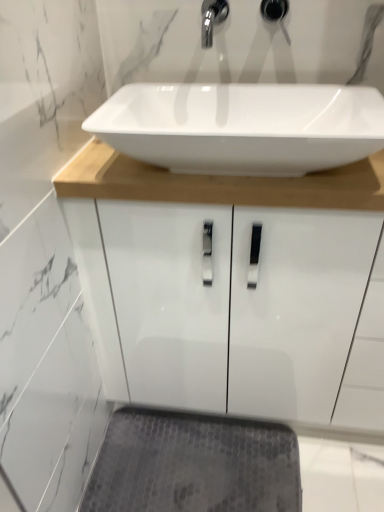
Image resolution: width=384 pixels, height=512 pixels. What do you see at coordinates (238, 87) in the screenshot? I see `white glossy sink at center` at bounding box center [238, 87].

Identify the location of matte black faucet at upper center. The height and width of the screenshot is (512, 384). (276, 13).

Is matte black faucet at upper center positioned before white glossy sink at center?

No, matte black faucet at upper center is further to the viewer.

Considering the sizes of objects matte black faucet at upper center and white glossy sink at center in the image provided, who is thinner, matte black faucet at upper center or white glossy sink at center?

Thinner between the two is matte black faucet at upper center.

Measure the distance from matte black faucet at upper center to white glossy sink at center.

The distance of matte black faucet at upper center from white glossy sink at center is 9.94 inches.

Who is shorter, matte black faucet at upper center or white glossy sink at center?

With less height is white glossy sink at center.

Considering the relative sizes of white glossy sink at center and matte black faucet at upper center in the image provided, is white glossy sink at center shorter than matte black faucet at upper center?

Yes.

Is white glossy sink at center bigger or smaller than matte black faucet at upper center?

Clearly, white glossy sink at center is larger in size than matte black faucet at upper center.

Locate an element on the screen. The width and height of the screenshot is (384, 512). sink that appears below the matte black faucet at upper center (from a real-world perspective) is located at coordinates (238, 87).

Is gray textured bath mat at lower center taller than matte black faucet at upper center?

No.

Between gray textured bath mat at lower center and matte black faucet at upper center, which one appears on the right side from the viewer's perspective?

matte black faucet at upper center.

Looking at this image, how far apart are gray textured bath mat at lower center and matte black faucet at upper center?

They are 1.18 meters apart.

Does gray textured bath mat at lower center have a larger size compared to matte black faucet at upper center?

Yes.

Which object is positioned more to the right, gray textured bath mat at lower center or white glossy sink at center?

white glossy sink at center.

Do you think gray textured bath mat at lower center is within white glossy sink at center, or outside of it?

gray textured bath mat at lower center is not enclosed by white glossy sink at center.

Which of these two, gray textured bath mat at lower center or white glossy sink at center, is bigger?

Bigger between the two is white glossy sink at center.

The width and height of the screenshot is (384, 512). I want to click on bath mat located underneath the white glossy sink at center (from a real-world perspective), so click(193, 465).

In the image, there is a gray textured bath mat at lower center. Identify the location of sink above it (from the image's perspective). The image size is (384, 512). point(238,87).

Is white glossy sink at center situated inside gray textured bath mat at lower center or outside?

white glossy sink at center is located beyond the bounds of gray textured bath mat at lower center.

Is point (282, 46) more distant than point (159, 443)?

No, it is in front of (159, 443).

From the image's perspective, is white glossy sink at center above gray textured bath mat at lower center?

Yes, from the image's perspective, white glossy sink at center is above gray textured bath mat at lower center.

Which object is closer to the camera, matte black faucet at upper center or gray textured bath mat at lower center?

matte black faucet at upper center is closer to the camera.

In terms of size, does matte black faucet at upper center appear bigger or smaller than gray textured bath mat at lower center?

matte black faucet at upper center is smaller than gray textured bath mat at lower center.

From the picture: From the image's perspective, is matte black faucet at upper center on top of gray textured bath mat at lower center?

Correct, matte black faucet at upper center appears higher than gray textured bath mat at lower center in the image.

Is matte black faucet at upper center situated inside gray textured bath mat at lower center or outside?

matte black faucet at upper center is not inside gray textured bath mat at lower center, it's outside.

There is a white glossy sink at center. At what (x,y) coordinates should I click in order to perform the action: click on plumbing fixture above it (from a real-world perspective). Please return your answer as a coordinate pair (x, y). Looking at the image, I should click on (276, 13).

In the image, there is a matte black faucet at upper center. Identify the location of sink below it (from a real-world perspective). (x=238, y=87).

From the picture: Based on their spatial positions, is white glossy sink at center or matte black faucet at upper center closer to gray textured bath mat at lower center?

Among the two, white glossy sink at center is located nearer to gray textured bath mat at lower center.

From the picture: Based on their spatial positions, is matte black faucet at upper center or white glossy sink at center further from gray textured bath mat at lower center?

matte black faucet at upper center lies further to gray textured bath mat at lower center than the other object.

Based on their spatial positions, is gray textured bath mat at lower center or matte black faucet at upper center closer to white glossy sink at center?

Based on the image, matte black faucet at upper center appears to be nearer to white glossy sink at center.

Which object lies further to the anchor point matte black faucet at upper center, white glossy sink at center or gray textured bath mat at lower center?

gray textured bath mat at lower center is positioned further to the anchor matte black faucet at upper center.

From the image, which object appears to be nearer to white glossy sink at center, matte black faucet at upper center or gray textured bath mat at lower center?

matte black faucet at upper center.

When comparing their distances from matte black faucet at upper center, does gray textured bath mat at lower center or white glossy sink at center seem closer?

white glossy sink at center lies closer to matte black faucet at upper center than the other object.

Where is `sink between matte black faucet at upper center and gray textured bath mat at lower center from top to bottom`? This screenshot has width=384, height=512. sink between matte black faucet at upper center and gray textured bath mat at lower center from top to bottom is located at coordinates (238, 87).